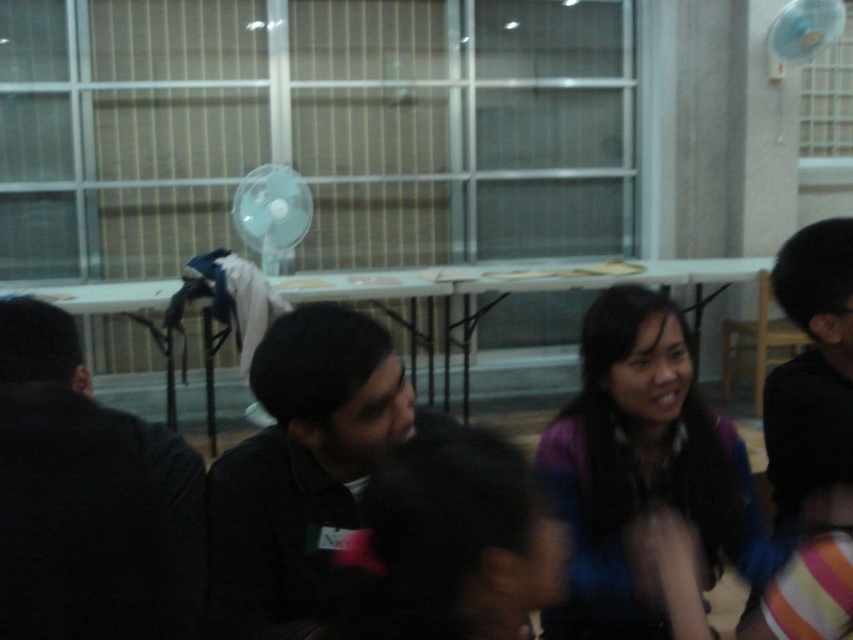
Does black matte shirt at center have a greater height compared to white plastic mechanical fan at upper right?

Yes, black matte shirt at center is taller than white plastic mechanical fan at upper right.

Does black matte shirt at center have a larger size compared to white plastic mechanical fan at upper right?

Indeed, black matte shirt at center has a larger size compared to white plastic mechanical fan at upper right.

What are the coordinates of `black matte shirt at center` in the screenshot? It's located at (300, 468).

You are a GUI agent. You are given a task and a screenshot of the screen. Output one action in this format:
    pyautogui.click(x=<x>, y=<y>)
    Task: Click on the black matte shirt at center
    
    Given the screenshot: What is the action you would take?
    pyautogui.click(x=300, y=468)

Looking at this image, measure the distance between point (668, 349) and camera.

4.75 feet

Can you confirm if multicolored fabric at center is shorter than white plastic fan at upper center?

Correct, multicolored fabric at center is not as tall as white plastic fan at upper center.

You are a GUI agent. You are given a task and a screenshot of the screen. Output one action in this format:
    pyautogui.click(x=<x>, y=<y>)
    Task: Click on the multicolored fabric at center
    This screenshot has width=853, height=640.
    Given the screenshot: What is the action you would take?
    pyautogui.click(x=642, y=467)

Between white plastic fan at upper center and white plastic mechanical fan at upper right, which one has less height?

white plastic mechanical fan at upper right is shorter.

The width and height of the screenshot is (853, 640). I want to click on white plastic fan at upper center, so click(x=271, y=211).

Which is in front, point (247, 189) or point (805, 42)?

Point (247, 189)

Identify the location of white plastic fan at upper center. The image size is (853, 640). (271, 211).